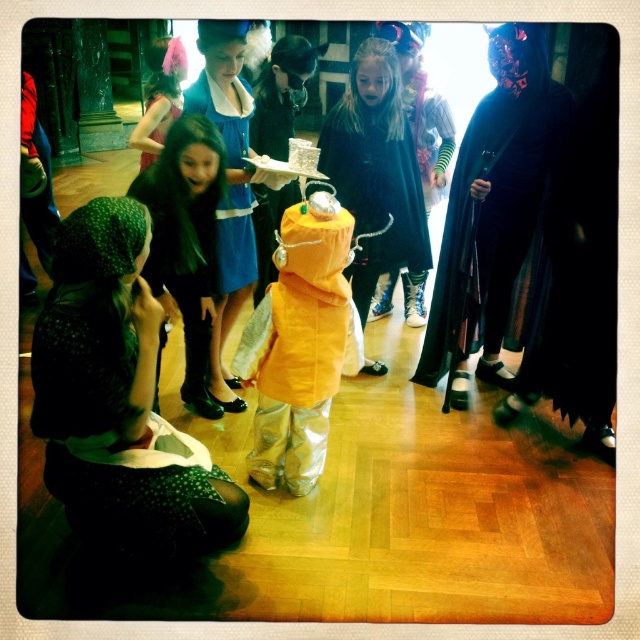
Question: Is the position of velvet black cape at center more distant than that of matte pink dress at upper left?

Choices:
 (A) yes
 (B) no

Answer: (B)

Question: Among these points, which one is nearest to the camera?

Choices:
 (A) (161, 132)
 (B) (282, 321)
 (C) (164, 129)

Answer: (B)

Question: Does orange metallic suit at center come behind matte orange raincoat at center?

Choices:
 (A) yes
 (B) no

Answer: (B)

Question: Which of the following is the closest to the observer?

Choices:
 (A) shiny pink feather at upper left
 (B) matte orange raincoat at center
 (C) velvet black cape at center
 (D) velvet blue dress at center

Answer: (B)

Question: Where is orange metallic suit at center located in relation to shiny pink feather at upper left in the image?

Choices:
 (A) left
 (B) right

Answer: (B)

Question: Which point is farther to the camera?

Choices:
 (A) (144, 164)
 (B) (138, 134)
 (C) (328, 168)

Answer: (A)